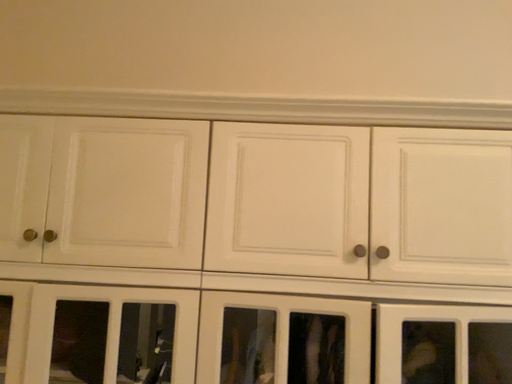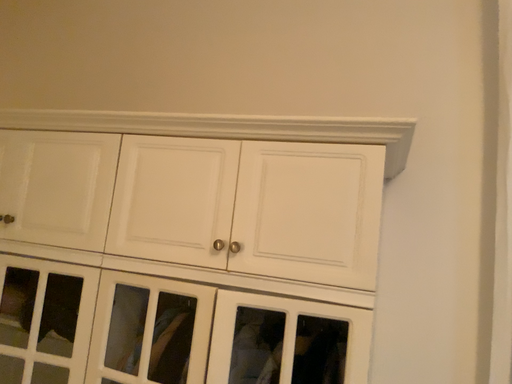
Question: How did the camera likely rotate when shooting the video?

Choices:
 (A) rotated right
 (B) rotated left

Answer: (B)